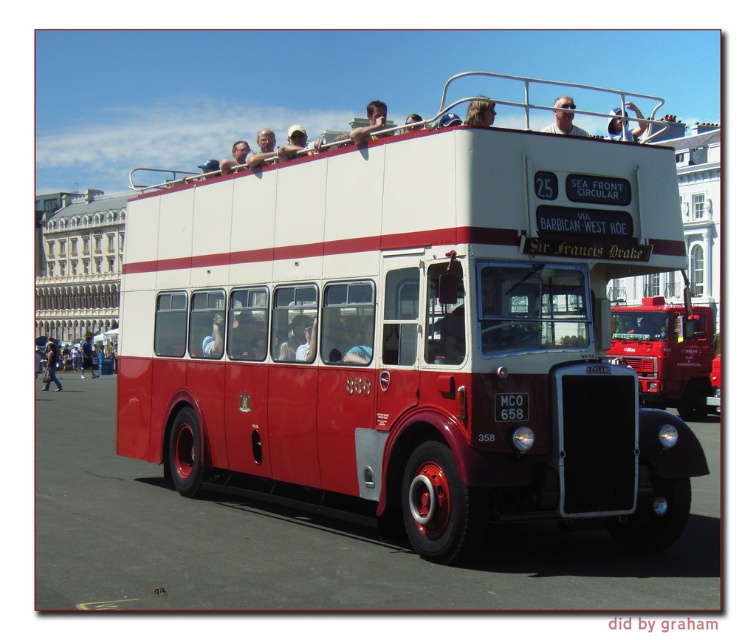
Can you confirm if matte black sunglasses at upper center is positioned to the left of white fabric cap at upper center?

No, matte black sunglasses at upper center is not to the left of white fabric cap at upper center.

Between point (562, 113) and point (279, 150), which one is positioned in front?

Point (562, 113) is in front.

You are a GUI agent. You are given a task and a screenshot of the screen. Output one action in this format:
    pyautogui.click(x=<x>, y=<y>)
    Task: Click on the matte black sunglasses at upper center
    The image size is (756, 640).
    Given the screenshot: What is the action you would take?
    pyautogui.click(x=564, y=116)

Can you confirm if dark blue jeans at lower left is bigger than smooth skin face at upper center?

Incorrect, dark blue jeans at lower left is not larger than smooth skin face at upper center.

Does dark blue jeans at lower left have a greater height compared to smooth skin face at upper center?

Incorrect, dark blue jeans at lower left's height is not larger of smooth skin face at upper center's.

Who is more distant from viewer, (51, 362) or (231, 148)?

The point (231, 148) is behind.

You are a GUI agent. You are given a task and a screenshot of the screen. Output one action in this format:
    pyautogui.click(x=<x>, y=<y>)
    Task: Click on the dark blue jeans at lower left
    The image size is (756, 640).
    Given the screenshot: What is the action you would take?
    click(x=50, y=365)

Who is taller, red metallic truck at center or matte skin at upper center?

matte skin at upper center is taller.

Is the position of red metallic truck at center more distant than that of matte skin at upper center?

No, it is not.

Does point (660, 305) lie in front of point (265, 134)?

No, (660, 305) is further to viewer.

Where is `red metallic truck at center`? red metallic truck at center is located at coordinates (668, 353).